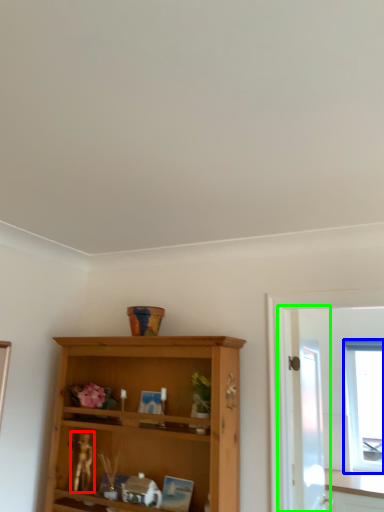
Question: Estimate the real-world distances between objects in this image. Which object is closer to miniature (highlighted by a red box), window (highlighted by a blue box) or screen door (highlighted by a green box)?

Choices:
 (A) window
 (B) screen door

Answer: (B)